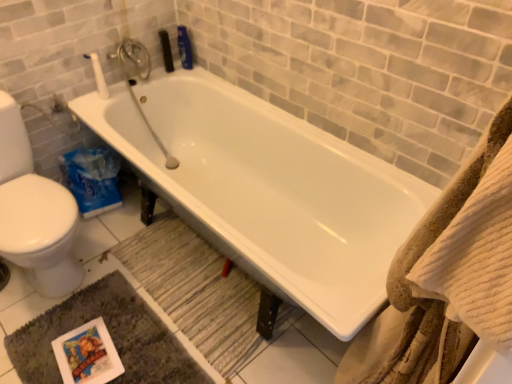
In order to face wooden textured bath mat at lower center, which is the first bath mat in top-to-bottom order, should I rotate leftwards or rightwards?

Turn left by 7.260 degrees to look at wooden textured bath mat at lower center, which is the first bath mat in top-to-bottom order.

What is the approximate height of wooden textured bath mat at lower center, which is the first bath mat in top-to-bottom order?

wooden textured bath mat at lower center, which is the first bath mat in top-to-bottom order, is 0.96 inches tall.

Locate an element on the screen. The height and width of the screenshot is (384, 512). dark gray plush bath mat at lower left, which ranks as the second bath mat in top-to-bottom order is located at coordinates (111, 337).

This screenshot has height=384, width=512. Find the location of `toilet paper located on the left of dark gray plush bath mat at lower left, arranged as the first bath mat when ordered from the bottom`. toilet paper located on the left of dark gray plush bath mat at lower left, arranged as the first bath mat when ordered from the bottom is located at coordinates point(99,77).

From the picture: Which object is positioned more to the right, white matte toilet paper at upper left or dark gray plush bath mat at lower left, arranged as the first bath mat when ordered from the bottom?

Positioned to the right is dark gray plush bath mat at lower left, arranged as the first bath mat when ordered from the bottom.

Relative to dark gray plush bath mat at lower left, arranged as the first bath mat when ordered from the bottom, is white matte toilet paper at upper left in front or behind?

In the image, white matte toilet paper at upper left appears behind dark gray plush bath mat at lower left, arranged as the first bath mat when ordered from the bottom.

From a real-world perspective, does white matte toilet paper at upper left stand above dark gray plush bath mat at lower left, arranged as the first bath mat when ordered from the bottom?

Yes, from a real-world perspective, white matte toilet paper at upper left is over dark gray plush bath mat at lower left, arranged as the first bath mat when ordered from the bottom

Is white matte toilet paper at upper left bigger than white glossy bathtub at center?

Actually, white matte toilet paper at upper left might be smaller than white glossy bathtub at center.

Does point (93, 61) come closer to viewer compared to point (206, 196)?

Yes, it is in front of point (206, 196).

Is white matte toilet paper at upper left looking in the opposite direction of white glossy bathtub at center?

No, white matte toilet paper at upper left's orientation is not away from white glossy bathtub at center.

Find the location of `the 1st bath mat positioned below the white matte toilet paper at upper left (from the image's perspective)`. the 1st bath mat positioned below the white matte toilet paper at upper left (from the image's perspective) is located at coordinates (196, 291).

Is wooden textured bath mat at lower center, which is counted as the 2th bath mat, starting from the bottom, at the right side of white matte toilet paper at upper left?

Yes.

Consider the image. From a real-world perspective, is wooden textured bath mat at lower center, which is the first bath mat in top-to-bottom order, physically below white matte toilet paper at upper left?

Yes, from a real-world perspective, wooden textured bath mat at lower center, which is the first bath mat in top-to-bottom order, is beneath white matte toilet paper at upper left.

From the image's perspective, which one is positioned higher, wooden textured bath mat at lower center, which is counted as the 2th bath mat, starting from the bottom, or white matte toilet paper at upper left?

white matte toilet paper at upper left.

Which of these two, white textured towel at right or dark gray plush bath mat at lower left, which ranks as the second bath mat in top-to-bottom order, is smaller?

With smaller size is dark gray plush bath mat at lower left, which ranks as the second bath mat in top-to-bottom order.

Can you tell me how much white textured towel at right and dark gray plush bath mat at lower left, arranged as the first bath mat when ordered from the bottom, differ in facing direction?

180 degrees.

From the image's perspective, is white textured towel at right positioned above or below dark gray plush bath mat at lower left, which ranks as the second bath mat in top-to-bottom order?

Based on their image positions, white textured towel at right is located above dark gray plush bath mat at lower left, which ranks as the second bath mat in top-to-bottom order.

Is wooden textured bath mat at lower center, which is the first bath mat in top-to-bottom order, bigger or smaller than dark gray plush bath mat at lower left, arranged as the first bath mat when ordered from the bottom?

In the image, wooden textured bath mat at lower center, which is the first bath mat in top-to-bottom order, appears to be smaller than dark gray plush bath mat at lower left, arranged as the first bath mat when ordered from the bottom.

Based on the photo, measure the distance from wooden textured bath mat at lower center, which is the first bath mat in top-to-bottom order, to dark gray plush bath mat at lower left, arranged as the first bath mat when ordered from the bottom.

wooden textured bath mat at lower center, which is the first bath mat in top-to-bottom order, is 9.48 inches from dark gray plush bath mat at lower left, arranged as the first bath mat when ordered from the bottom.

From a real-world perspective, is wooden textured bath mat at lower center, which is counted as the 2th bath mat, starting from the bottom, below dark gray plush bath mat at lower left, arranged as the first bath mat when ordered from the bottom?

No, from a real-world perspective, wooden textured bath mat at lower center, which is counted as the 2th bath mat, starting from the bottom, is not beneath dark gray plush bath mat at lower left, arranged as the first bath mat when ordered from the bottom.

From the picture: Which object is closer to the camera taking this photo, wooden textured bath mat at lower center, which is the first bath mat in top-to-bottom order, or dark gray plush bath mat at lower left, arranged as the first bath mat when ordered from the bottom?

Positioned in front is dark gray plush bath mat at lower left, arranged as the first bath mat when ordered from the bottom.

Does dark gray plush bath mat at lower left, arranged as the first bath mat when ordered from the bottom, touch white textured towel at right?

dark gray plush bath mat at lower left, arranged as the first bath mat when ordered from the bottom, is not next to white textured towel at right, and they're not touching.

From a real-world perspective, who is located lower, dark gray plush bath mat at lower left, arranged as the first bath mat when ordered from the bottom, or white textured towel at right?

dark gray plush bath mat at lower left, arranged as the first bath mat when ordered from the bottom, is physically lower.

Starting from the white textured towel at right, which bath mat is the 2nd one to the left? Please provide its 2D coordinates.

[(111, 337)]

How many degrees apart are the facing directions of dark gray plush bath mat at lower left, which ranks as the second bath mat in top-to-bottom order, and white textured towel at right?

They differ by 180 degrees in their facing directions.

Which of these two, dark gray plush bath mat at lower left, arranged as the first bath mat when ordered from the bottom, or wooden textured bath mat at lower center, which is counted as the 2th bath mat, starting from the bottom, is bigger?

Bigger between the two is dark gray plush bath mat at lower left, arranged as the first bath mat when ordered from the bottom.

The image size is (512, 384). What are the coordinates of `bath mat that appears above the dark gray plush bath mat at lower left, which ranks as the second bath mat in top-to-bottom order (from the image's perspective)` in the screenshot? It's located at (196, 291).

Does point (96, 288) come closer to viewer compared to point (246, 330)?

No, it is not.

In terms of height, does dark gray plush bath mat at lower left, which ranks as the second bath mat in top-to-bottom order, look taller or shorter compared to wooden textured bath mat at lower center, which is counted as the 2th bath mat, starting from the bottom?

Clearly, dark gray plush bath mat at lower left, which ranks as the second bath mat in top-to-bottom order, is shorter compared to wooden textured bath mat at lower center, which is counted as the 2th bath mat, starting from the bottom.

Locate an element on the screen. Image resolution: width=512 pixels, height=384 pixels. toilet paper above the dark gray plush bath mat at lower left, which ranks as the second bath mat in top-to-bottom order (from the image's perspective) is located at coordinates (99, 77).

Find the location of a particular element. The height and width of the screenshot is (384, 512). bathtub on the right of the white matte toilet paper at upper left is located at coordinates (268, 190).

From the image, which object appears to be nearer to dark gray plush bath mat at lower left, arranged as the first bath mat when ordered from the bottom, wooden textured bath mat at lower center, which is counted as the 2th bath mat, starting from the bottom, or white textured towel at right?

Based on the image, wooden textured bath mat at lower center, which is counted as the 2th bath mat, starting from the bottom, appears to be nearer to dark gray plush bath mat at lower left, arranged as the first bath mat when ordered from the bottom.

Estimate the real-world distances between objects in this image. Which object is further from white textured towel at right, white matte toilet paper at upper left or wooden textured bath mat at lower center, which is counted as the 2th bath mat, starting from the bottom?

Based on the image, white matte toilet paper at upper left appears to be further to white textured towel at right.

Looking at the image, which one is located closer to white matte toilet paper at upper left, white glossy bathtub at center or white textured towel at right?

white glossy bathtub at center.

Based on their spatial positions, is wooden textured bath mat at lower center, which is counted as the 2th bath mat, starting from the bottom, or white matte toilet paper at upper left further from white glossy bathtub at center?

The object further to white glossy bathtub at center is white matte toilet paper at upper left.

Which object lies nearer to the anchor point white matte toilet paper at upper left, white textured towel at right or wooden textured bath mat at lower center, which is the first bath mat in top-to-bottom order?

Among the two, wooden textured bath mat at lower center, which is the first bath mat in top-to-bottom order, is located nearer to white matte toilet paper at upper left.

Considering their positions, is white textured towel at right positioned further to wooden textured bath mat at lower center, which is the first bath mat in top-to-bottom order, than white glossy bathtub at center?

Based on the image, white textured towel at right appears to be further to wooden textured bath mat at lower center, which is the first bath mat in top-to-bottom order.

From the image, which object appears to be nearer to wooden textured bath mat at lower center, which is counted as the 2th bath mat, starting from the bottom, dark gray plush bath mat at lower left, arranged as the first bath mat when ordered from the bottom, or white glossy bathtub at center?

Based on the image, dark gray plush bath mat at lower left, arranged as the first bath mat when ordered from the bottom, appears to be nearer to wooden textured bath mat at lower center, which is counted as the 2th bath mat, starting from the bottom.

Looking at the image, which one is located further to dark gray plush bath mat at lower left, arranged as the first bath mat when ordered from the bottom, wooden textured bath mat at lower center, which is counted as the 2th bath mat, starting from the bottom, or white glossy bathtub at center?

white glossy bathtub at center is further to dark gray plush bath mat at lower left, arranged as the first bath mat when ordered from the bottom.

The image size is (512, 384). I want to click on bath mat that lies between white matte toilet paper at upper left and dark gray plush bath mat at lower left, which ranks as the second bath mat in top-to-bottom order, from top to bottom, so click(196, 291).

Where is `bath mat between white glossy bathtub at center and dark gray plush bath mat at lower left, arranged as the first bath mat when ordered from the bottom, vertically`? Image resolution: width=512 pixels, height=384 pixels. bath mat between white glossy bathtub at center and dark gray plush bath mat at lower left, arranged as the first bath mat when ordered from the bottom, vertically is located at coordinates (196, 291).

Where is `bathtub positioned between white textured towel at right and dark gray plush bath mat at lower left, which ranks as the second bath mat in top-to-bottom order, from near to far`? bathtub positioned between white textured towel at right and dark gray plush bath mat at lower left, which ranks as the second bath mat in top-to-bottom order, from near to far is located at coordinates (268, 190).

Identify the location of bathtub between white matte toilet paper at upper left and dark gray plush bath mat at lower left, which ranks as the second bath mat in top-to-bottom order, vertically. Image resolution: width=512 pixels, height=384 pixels. (268, 190).